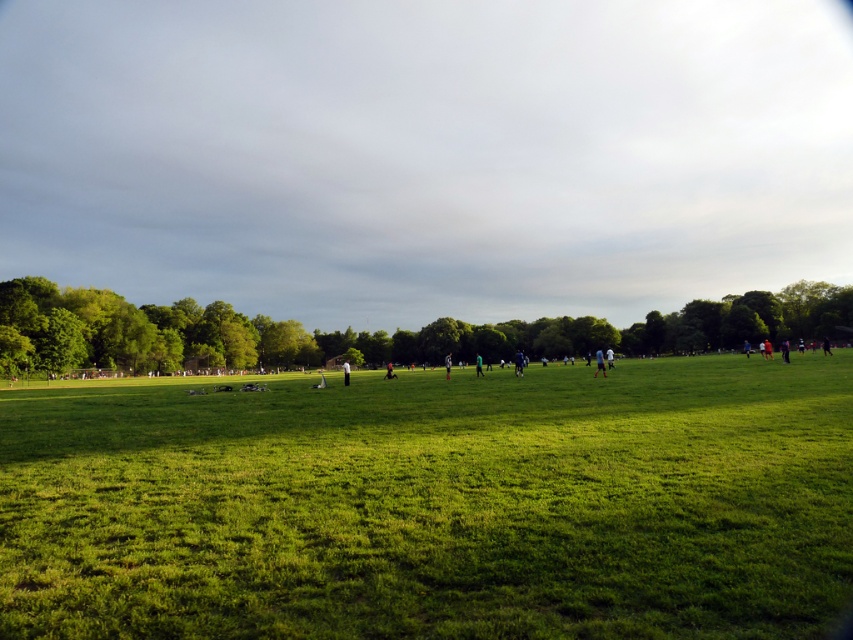
Does dark blue shirt at center have a lesser height compared to green fabric person at center?

Yes.

Who is lower down, dark blue shirt at center or green fabric person at center?

green fabric person at center is below.

Locate an element on the screen. The width and height of the screenshot is (853, 640). dark blue shirt at center is located at coordinates (479, 364).

What do you see at coordinates (426, 154) in the screenshot? I see `cloudy sky at upper center` at bounding box center [426, 154].

From the picture: Can you confirm if cloudy sky at upper center is taller than dark blue shirt at center?

Yes, cloudy sky at upper center is taller than dark blue shirt at center.

Where is `cloudy sky at upper center`? The height and width of the screenshot is (640, 853). cloudy sky at upper center is located at coordinates (426, 154).

Who is lower down, dark blue jersey at center-right or dark blue shirt at right?

dark blue jersey at center-right

Does point (593, 372) come farther from viewer compared to point (788, 356)?

No, it is not.

In order to click on dark blue jersey at center-right in this screenshot , I will do `click(599, 362)`.